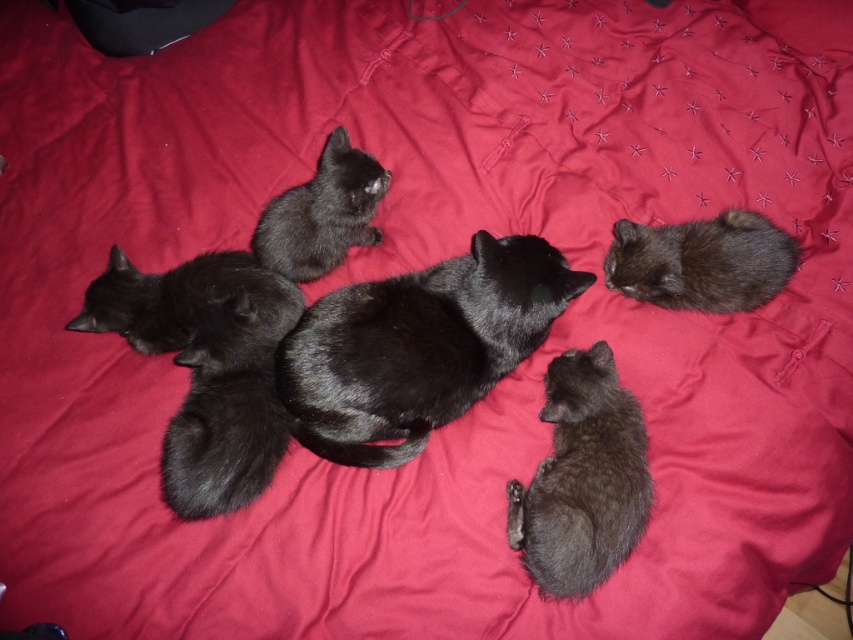
You are taking a photo of the black cats on the red bedspread. You notice two points marked in the image. Which point, point (509, 540) or point (305, 259), is closer to the camera?

Point (509, 540) is closer to the camera than point (305, 259).

You are a photographer standing in front of the red bedspread with the matte black cat at center. You want to capture a closeup shot of the cat without moving any of the cats. Can you get within 3 feet of the cat to take the photo?

The matte black cat at center is 3.50 feet from viewer, so yes, you can get within 3 feet of the cat to take the photo since the cat is already 3.5 feet away, which is slightly beyond the desired distance.

You are a photographer trying to capture a closeup of the matte black cat at center. You are currently positioned at point (228, 406). Is the matte black cat at center within your camera frame?

The point (228, 406) is where the matte black cat at center is located, so yes, the matte black cat at center is within your camera frame.